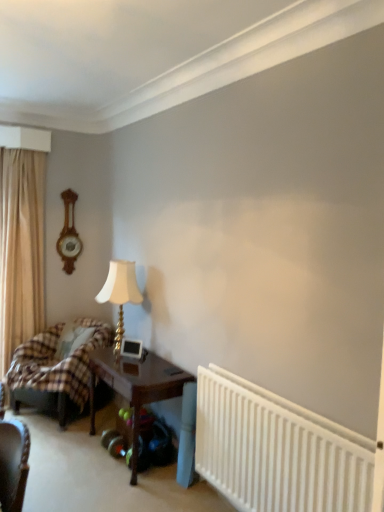
Question: Should I look upward or downward to see beige fabric curtain at left?

Choices:
 (A) up
 (B) down

Answer: (B)

Question: Does wooden table at center appear on the right side of white plastic radiator at lower right?

Choices:
 (A) no
 (B) yes

Answer: (A)

Question: From the image's perspective, does wooden table at center appear higher than white plastic radiator at lower right?

Choices:
 (A) no
 (B) yes

Answer: (A)

Question: Could you tell me if wooden table at center is turned towards white plastic radiator at lower right?

Choices:
 (A) no
 (B) yes

Answer: (A)

Question: From a real-world perspective, is wooden table at center on white plastic radiator at lower right?

Choices:
 (A) yes
 (B) no

Answer: (B)

Question: Considering the relative positions of wooden table at center and white plastic radiator at lower right in the image provided, is wooden table at center to the left of white plastic radiator at lower right from the viewer's perspective?

Choices:
 (A) yes
 (B) no

Answer: (A)

Question: From the image's perspective, is wooden table at center beneath white plastic radiator at lower right?

Choices:
 (A) yes
 (B) no

Answer: (A)

Question: From a real-world perspective, is beige fabric curtain at left located beneath gold metallic table lamp at center-left?

Choices:
 (A) yes
 (B) no

Answer: (B)

Question: Is beige fabric curtain at left not near gold metallic table lamp at center-left?

Choices:
 (A) no
 (B) yes

Answer: (B)

Question: Can you confirm if beige fabric curtain at left is smaller than gold metallic table lamp at center-left?

Choices:
 (A) no
 (B) yes

Answer: (A)

Question: From the image's perspective, is beige fabric curtain at left above gold metallic table lamp at center-left?

Choices:
 (A) no
 (B) yes

Answer: (B)

Question: Is beige fabric curtain at left facing towards gold metallic table lamp at center-left?

Choices:
 (A) yes
 (B) no

Answer: (B)

Question: From a real-world perspective, is beige fabric curtain at left over gold metallic table lamp at center-left?

Choices:
 (A) yes
 (B) no

Answer: (A)

Question: From the image's perspective, is wooden clock at left below wooden table at center?

Choices:
 (A) yes
 (B) no

Answer: (B)